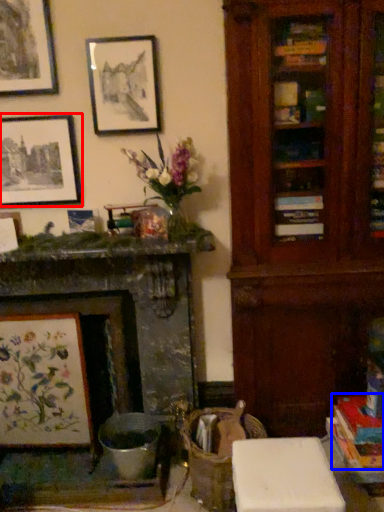
Question: Which of the following is the farthest to the observer, picture frame (highlighted by a red box) or book (highlighted by a blue box)?

Choices:
 (A) picture frame
 (B) book

Answer: (A)